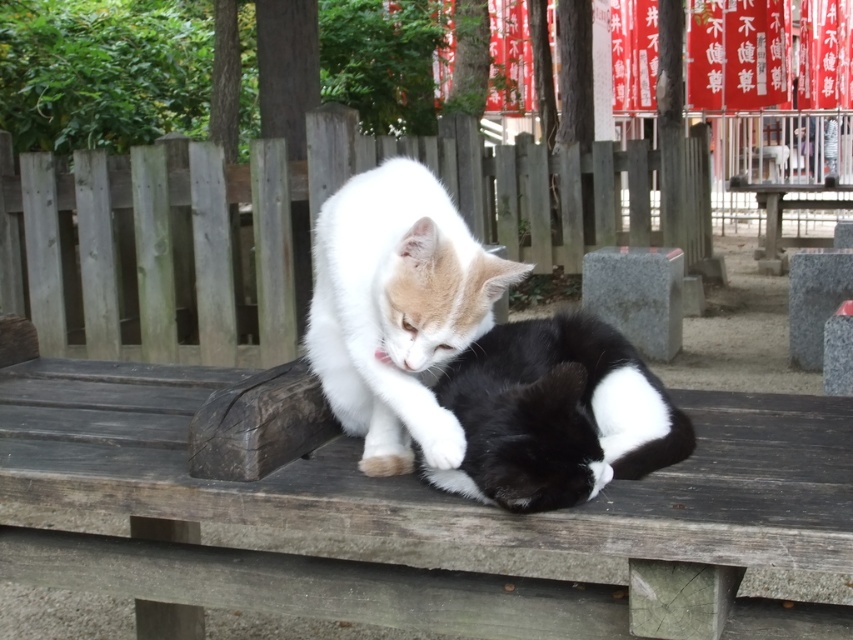
Question: In this image, where is white fluffy cat at center located relative to wooden picnic table at center?

Choices:
 (A) right
 (B) left

Answer: (B)

Question: Among these points, which one is nearest to the camera?

Choices:
 (A) (354, 292)
 (B) (776, 253)
 (C) (648, 440)

Answer: (C)

Question: Which point is farther to the camera?

Choices:
 (A) white fluffy cat at center
 (B) wooden picnic table at center

Answer: (B)

Question: Is black soft fur cat at center further to the viewer compared to wooden picnic table at center?

Choices:
 (A) yes
 (B) no

Answer: (B)

Question: Which object appears farthest from the camera in this image?

Choices:
 (A) black soft fur cat at center
 (B) wooden picnic table at center
 (C) white fluffy cat at center

Answer: (B)

Question: Considering the relative positions of white fluffy cat at center and black soft fur cat at center in the image provided, where is white fluffy cat at center located with respect to black soft fur cat at center?

Choices:
 (A) left
 (B) right

Answer: (A)